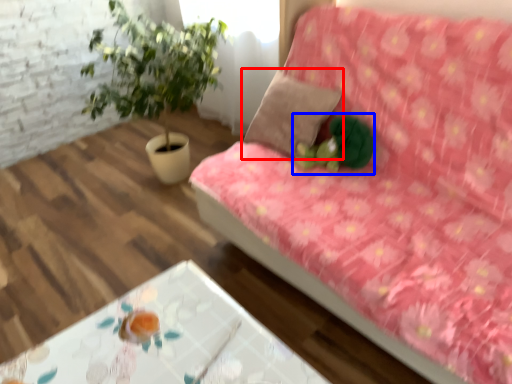
Question: Which object is further to the camera taking this photo, pillow (highlighted by a red box) or toy (highlighted by a blue box)?

Choices:
 (A) pillow
 (B) toy

Answer: (A)